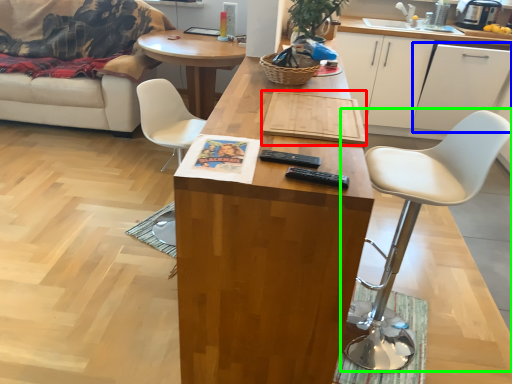
Question: Which object is the closest to the plank (highlighted by a red box)? Choose among these: cabinetry (highlighted by a blue box) or chair (highlighted by a green box).

Choices:
 (A) cabinetry
 (B) chair

Answer: (B)